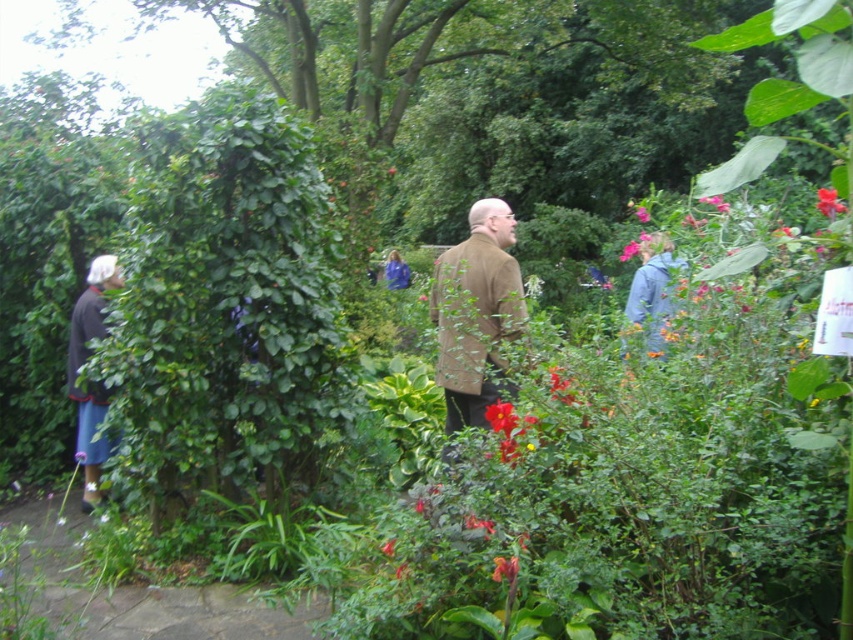
You are a photographer trying to capture a group shot of the two people in the garden. You notice the brown woolen coat at center and the blue fabric jacket at center. Which person should you ask to move closer to the camera to ensure both are equally visible in the photo?

The brown woolen coat at center has a lesser width compared to blue fabric jacket at center, so you should ask the person wearing the brown woolen coat at center to move closer to the camera to balance their visibility in the photo.

You are standing in the garden and see a person wearing blue denim pants at left and some vivid red petals at center. Which object is located to the east of the other?

The blue denim pants at left is to the left of vivid red petals at center, so the blue denim pants at left is located to the west of the vivid red petals at center. Therefore, the vivid red petals at center is to the east of the blue denim pants at left.

You are a photographer trying to capture a clear shot of the blue denim pants at left and the pink matte flower at upper right in the garden. Based on their positions, which object is closer to the camera?

The blue denim pants at left is below the pink matte flower at upper right, which means it is closer to the camera.